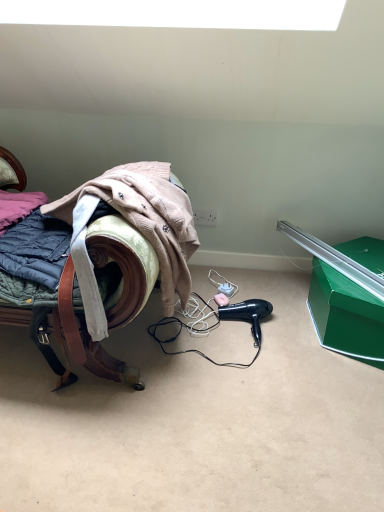
I want to click on free spot in front of black plastic hair dryer at lower center, so click(x=261, y=364).